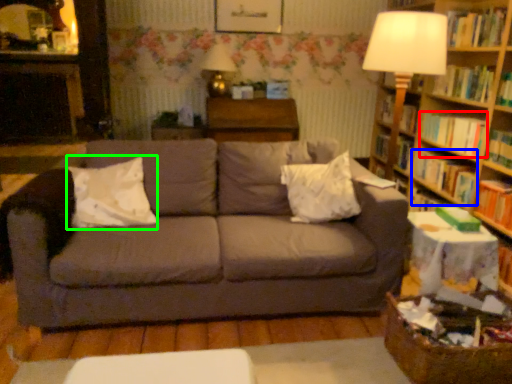
Question: Estimate the real-world distances between objects in this image. Which object is farther from book (highlighted by a red box), book (highlighted by a blue box) or pillow (highlighted by a green box)?

Choices:
 (A) book
 (B) pillow

Answer: (B)